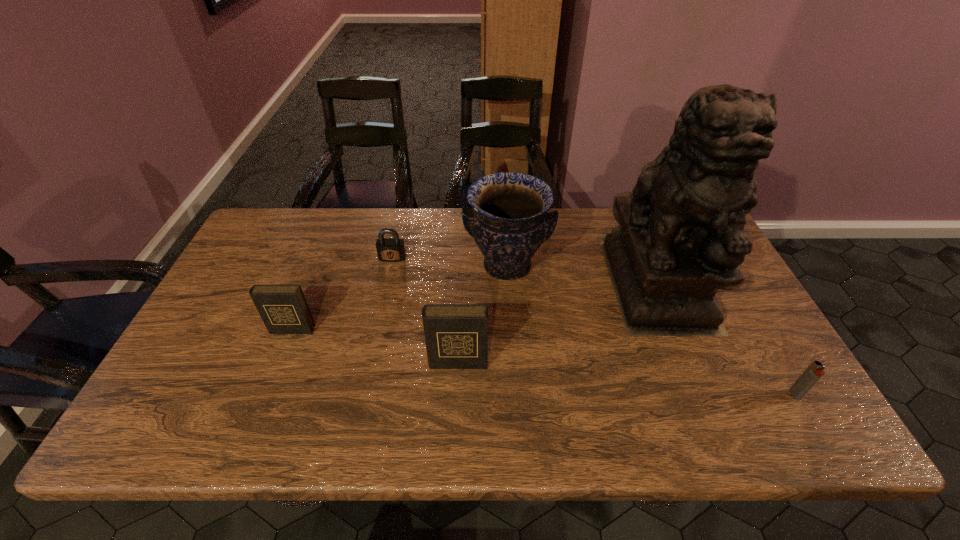
Please point a free position for a diary on the right. Please provide its 2D coordinates. Your answer should be formatted as a tuple, i.e. [(x, y)], where the tuple contains the x and y coordinates of a point satisfying the conditions above.

[(648, 400)]